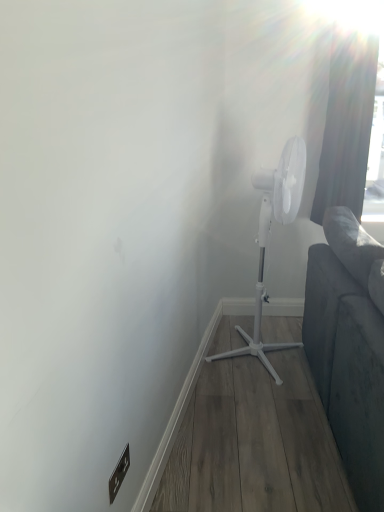
Question: From the image's perspective, is brown matte electric outlet at lower left located above white plastic mechanical fan at center?

Choices:
 (A) no
 (B) yes

Answer: (A)

Question: From a real-world perspective, does brown matte electric outlet at lower left stand above white plastic mechanical fan at center?

Choices:
 (A) yes
 (B) no

Answer: (B)

Question: Is brown matte electric outlet at lower left placed right next to white plastic mechanical fan at center?

Choices:
 (A) no
 (B) yes

Answer: (A)

Question: Is brown matte electric outlet at lower left smaller than white plastic mechanical fan at center?

Choices:
 (A) yes
 (B) no

Answer: (A)

Question: Considering the relative sizes of brown matte electric outlet at lower left and white plastic mechanical fan at center in the image provided, is brown matte electric outlet at lower left thinner than white plastic mechanical fan at center?

Choices:
 (A) no
 (B) yes

Answer: (B)

Question: Is dark gray fabric curtain at upper right in front of or behind brown matte electric outlet at lower left in the image?

Choices:
 (A) front
 (B) behind

Answer: (B)

Question: Looking at their shapes, would you say dark gray fabric curtain at upper right is wider or thinner than brown matte electric outlet at lower left?

Choices:
 (A) thin
 (B) wide

Answer: (B)

Question: Do you think dark gray fabric curtain at upper right is within brown matte electric outlet at lower left, or outside of it?

Choices:
 (A) outside
 (B) inside

Answer: (A)

Question: Is point (331, 54) positioned closer to the camera than point (125, 470)?

Choices:
 (A) closer
 (B) farther

Answer: (B)

Question: Relative to dark gray fabric curtain at upper right, is brown matte electric outlet at lower left in front or behind?

Choices:
 (A) behind
 (B) front

Answer: (B)

Question: Looking at the image, does brown matte electric outlet at lower left seem bigger or smaller compared to dark gray fabric curtain at upper right?

Choices:
 (A) small
 (B) big

Answer: (A)

Question: Considering the positions of point (117, 471) and point (370, 40), is point (117, 471) closer or farther from the camera than point (370, 40)?

Choices:
 (A) farther
 (B) closer

Answer: (B)

Question: Considering the positions of brown matte electric outlet at lower left and dark gray fabric curtain at upper right in the image, is brown matte electric outlet at lower left taller or shorter than dark gray fabric curtain at upper right?

Choices:
 (A) short
 (B) tall

Answer: (A)

Question: From the image's perspective, is brown matte electric outlet at lower left positioned above or below white plastic mechanical fan at center?

Choices:
 (A) above
 (B) below

Answer: (B)

Question: Would you say brown matte electric outlet at lower left is inside or outside white plastic mechanical fan at center?

Choices:
 (A) outside
 (B) inside

Answer: (A)